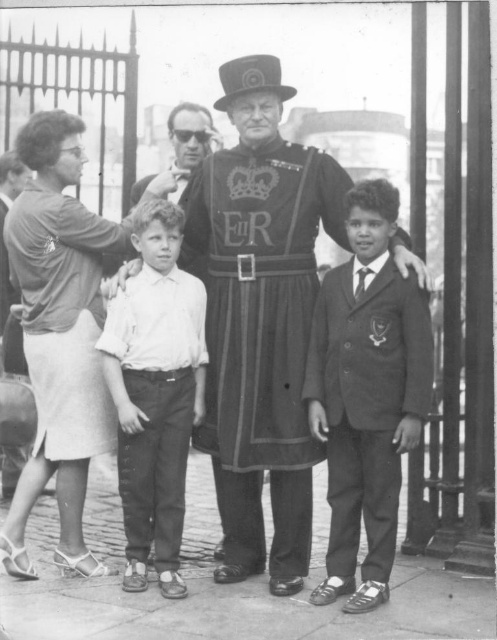
You are standing in front of the black and white photograph described. You notice a point marked at coordinates (366, 394). Which object in the scene does this point correspond to?

The point at (366, 394) corresponds to the smooth black suit at center.

You are standing at the point with coordinates point (127, 458) and want to walk to the point with coordinates point (345, 490). Which direction should you move to reach your destination?

You should move forward because point (345, 490) is in front of point (127, 458).